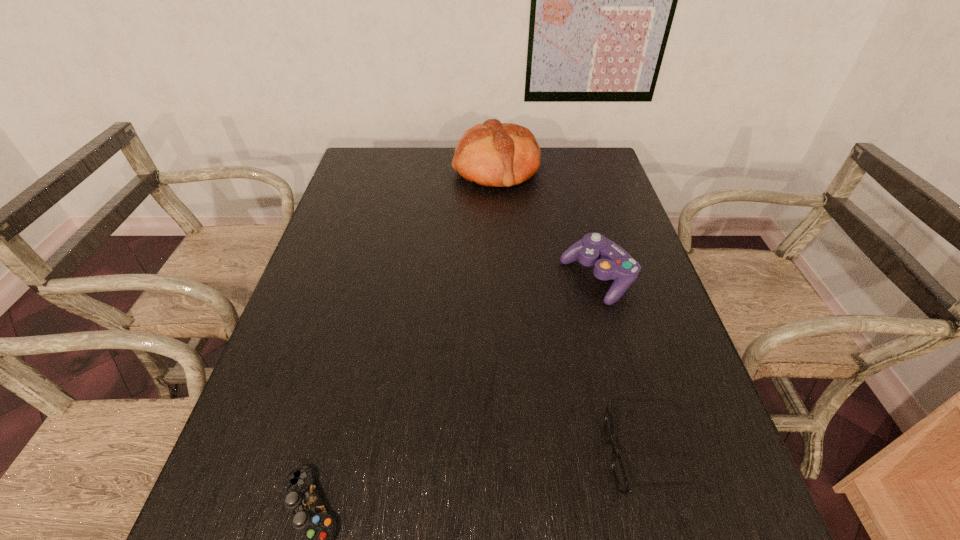
What are the coordinates of `object situated at the far edge` in the screenshot? It's located at (495, 154).

Identify the location of control located at the right edge. The height and width of the screenshot is (540, 960). (611, 262).

Locate an element on the screen. spectacles at the right edge is located at coordinates (620, 476).

Where is `vacant space at the far edge of the desktop`? The width and height of the screenshot is (960, 540). vacant space at the far edge of the desktop is located at coordinates (416, 148).

I want to click on vacant space at the left edge of the desktop, so click(x=332, y=323).

Image resolution: width=960 pixels, height=540 pixels. In the image, there is a desktop. In order to click on vacant area at the right edge in this screenshot , I will do [643, 258].

The image size is (960, 540). In order to click on vacant space at the far right corner of the desktop in this screenshot , I will do `click(587, 160)`.

This screenshot has height=540, width=960. In order to click on empty location between the spectacles and the farthest object in this screenshot , I will do `click(573, 313)`.

Where is `blank region between the bread and the right control`? The height and width of the screenshot is (540, 960). blank region between the bread and the right control is located at coordinates (547, 224).

Find the location of a particular element. This screenshot has height=540, width=960. free space between the third tallest object and the tallest object is located at coordinates (573, 313).